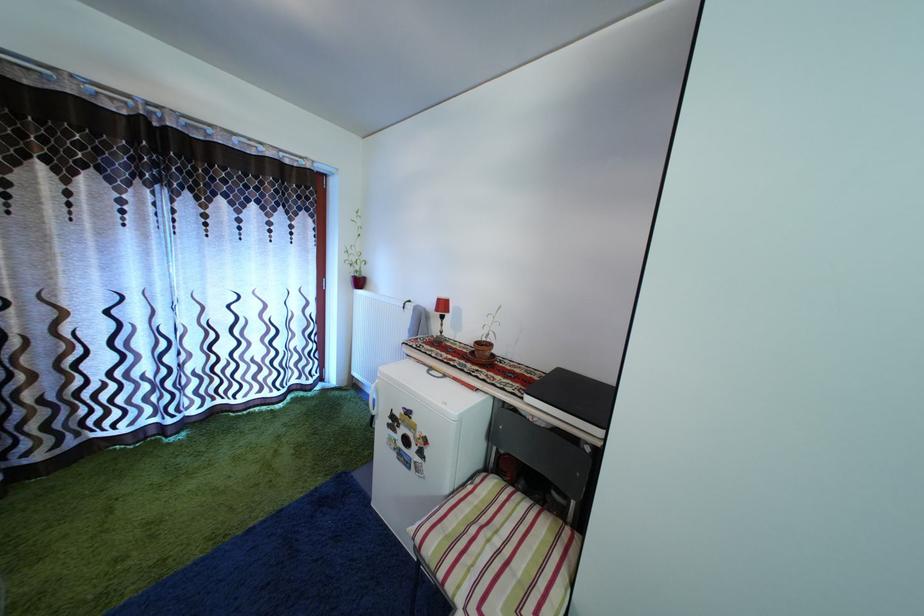
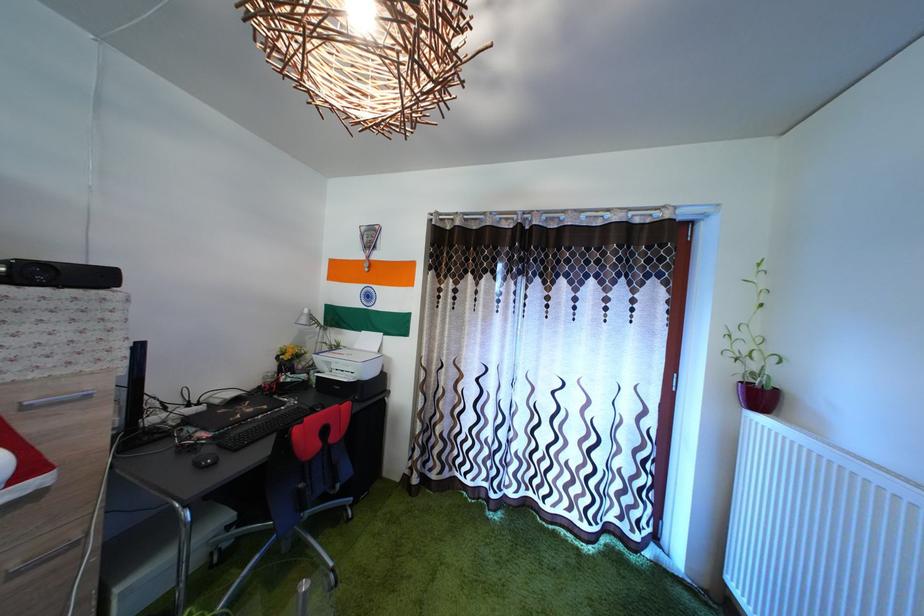
Question: The camera is either moving clockwise (left) or counter-clockwise (right) around the object. The first image is from the beginning of the video and the second image is from the end. Is the camera moving left or right when shooting the video?

Choices:
 (A) Left
 (B) Right

Answer: (B)